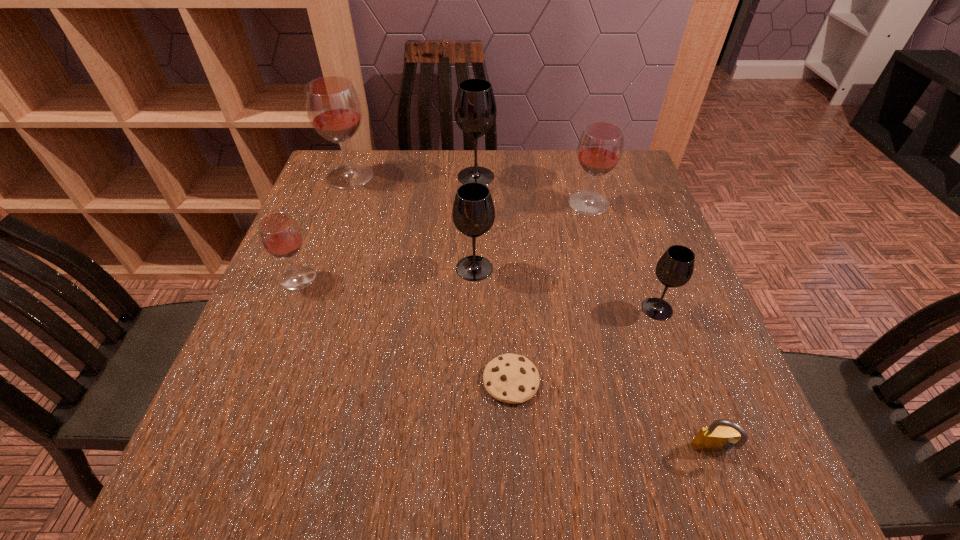
The height and width of the screenshot is (540, 960). Identify the location of object that is at the near edge. (714, 438).

Locate an element on the screen. padlock situated at the right edge is located at coordinates (714, 438).

This screenshot has width=960, height=540. In order to click on object located at the far left corner in this screenshot , I will do `click(333, 107)`.

Image resolution: width=960 pixels, height=540 pixels. I want to click on object situated at the far right corner, so click(600, 147).

The image size is (960, 540). Identify the location of object that is at the near right corner. (714, 438).

In the image, there is a desktop. Where is `vacant region at the far edge`? vacant region at the far edge is located at coordinates (569, 180).

Locate an element on the screen. free region at the near edge is located at coordinates (363, 499).

The width and height of the screenshot is (960, 540). In the image, there is a desktop. What are the coordinates of `blank space at the left edge` in the screenshot? It's located at (318, 353).

You are a GUI agent. You are given a task and a screenshot of the screen. Output one action in this format:
    pyautogui.click(x=<x>, y=<y>)
    Task: Click on the vacant position at the right edge of the desktop
    
    Given the screenshot: What is the action you would take?
    pyautogui.click(x=626, y=247)

You are a GUI agent. You are given a task and a screenshot of the screen. Output one action in this format:
    pyautogui.click(x=<x>, y=<y>)
    Task: Click on the free space between the second smallest gray wineglass and the padlock
    The width and height of the screenshot is (960, 540).
    Given the screenshot: What is the action you would take?
    pyautogui.click(x=593, y=360)